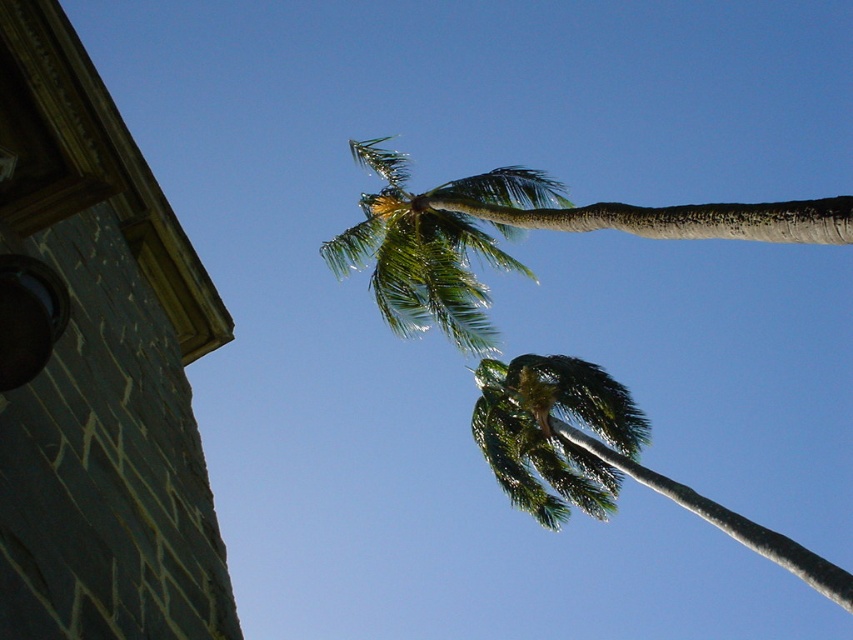
Is green leafy palm tree at upper center below green leafy palm at upper center?

No.

Between point (338, 250) and point (508, 451), which one is positioned behind?

Positioned behind is point (508, 451).

Identify the location of green leafy palm tree at upper center. (432, 244).